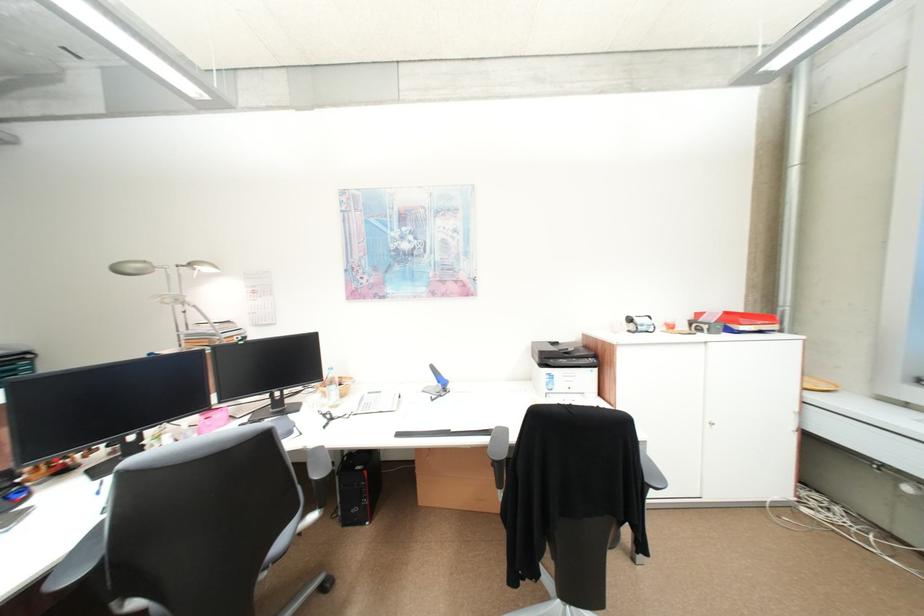
You are a GUI agent. You are given a task and a screenshot of the screen. Output one action in this format:
    pyautogui.click(x=<x>, y=<y>)
    Task: Click on the printer scanner lid
    
    Given the screenshot: What is the action you would take?
    pyautogui.click(x=563, y=354)